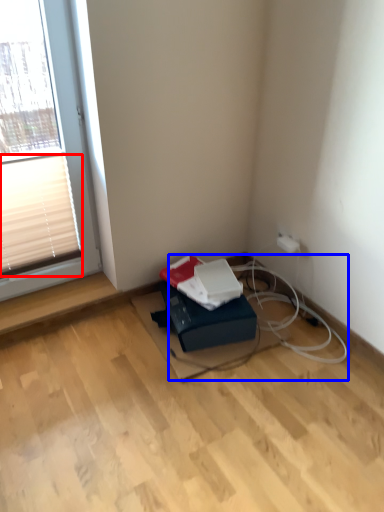
Question: Which point is further to the camera, blind (highlighted by a red box) or cable (highlighted by a blue box)?

Choices:
 (A) blind
 (B) cable

Answer: (B)